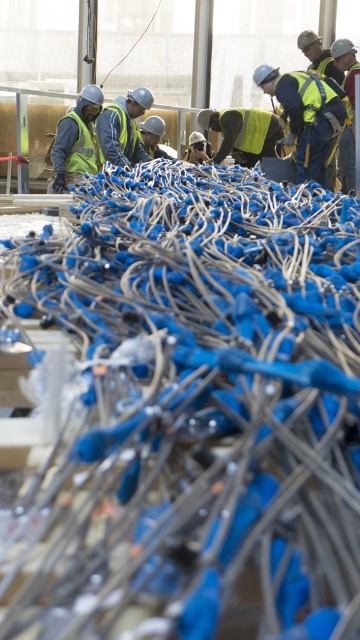
You are a worker in the construction area and need to determine the distance between two points marked on the blueprint. The points are labeled as point (299, 122) and point (244, 148). Based on the image provided, which point is nearer to your current position?

Point (299, 122) is closer to the camera than point (244, 148), so the point (299, 122) is nearer to your current position.

You are a supervisor in the construction area. You need to ensure that the reflective yellow vest at upper right and the matte black safety vest at left are at least 10 feet apart for safety protocols. Are they currently compliant with this requirement?

The distance between the reflective yellow vest at upper right and the matte black safety vest at left is 7.65 feet, which is less than the required 10 feet. Therefore, they are not compliant with the safety protocols.

You are a safety inspector checking the visibility of safety gear in the construction area. You notice two yellow reflective vests. The first is the reflective yellow vest at upper right, and the second is the yellow reflective safety vest at center. Which one is more visible to someone entering the area from the front door located at the lower left?

The reflective yellow vest at upper right is more visible because it is in front of the yellow reflective safety vest at center, making it closer to the entrance from the lower left.